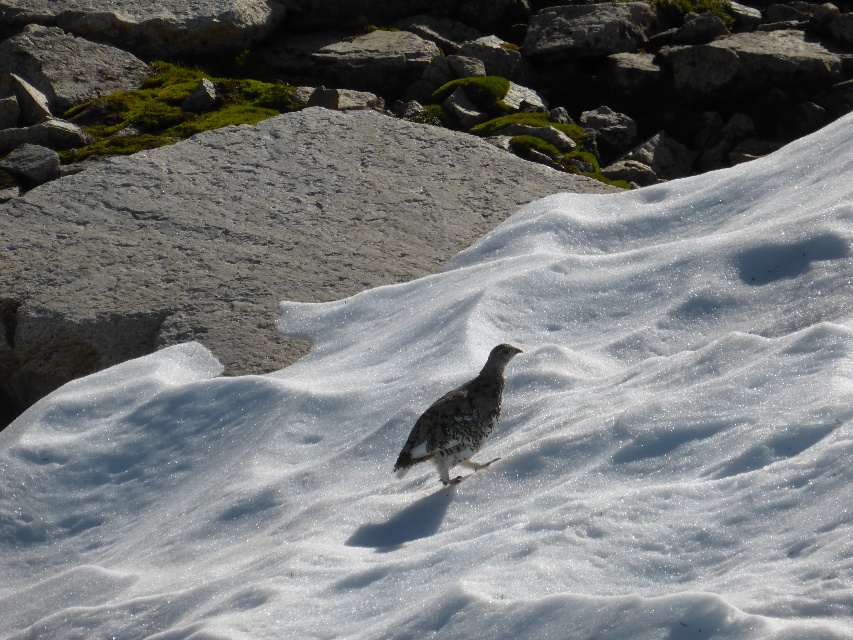
Does point (142, 346) come farther from viewer compared to point (492, 358)?

Yes, it is.

Between point (332, 132) and point (457, 433), which one is positioned behind?

The point (332, 132) is behind.

At what (x,y) coordinates should I click in order to perform the action: click on gray rough rock at center. Please return your answer as a coordinate pair (x, y). The height and width of the screenshot is (640, 853). Looking at the image, I should click on (236, 237).